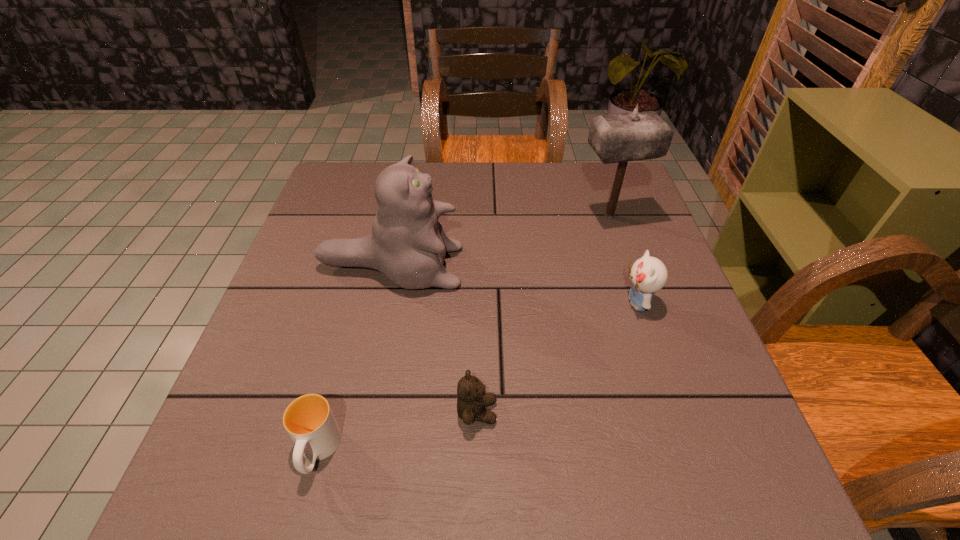
Identify the location of free spot between the third object from right to left and the third shortest object. The width and height of the screenshot is (960, 540). (557, 357).

The height and width of the screenshot is (540, 960). I want to click on unoccupied area between the third object from left to right and the cat, so pos(434,339).

I want to click on vacant area that lies between the teddy bear and the shortest object, so click(x=397, y=431).

This screenshot has width=960, height=540. I want to click on free space between the cup and the cat, so [354, 359].

Where is `vacant area that lies between the teddy bear and the cat`? vacant area that lies between the teddy bear and the cat is located at coordinates (434, 339).

Where is `empty space between the cat and the mallet`? The width and height of the screenshot is (960, 540). empty space between the cat and the mallet is located at coordinates (500, 241).

Locate an element on the screen. This screenshot has height=540, width=960. object that is the closest one to the third shortest object is located at coordinates (616, 138).

Locate an element on the screen. The height and width of the screenshot is (540, 960). the third closest object relative to the farthest object is located at coordinates (472, 400).

Identify the location of free space that satisfies the following two spatial constraints: 1. on the front-facing side of the third shortest object; 2. with the handle on the side of the cup. (687, 451).

What are the coordinates of `free spot that satisfies the following two spatial constraints: 1. on the face of the third object from right to left; 2. with the handle on the side of the cup` in the screenshot? It's located at [x=477, y=451].